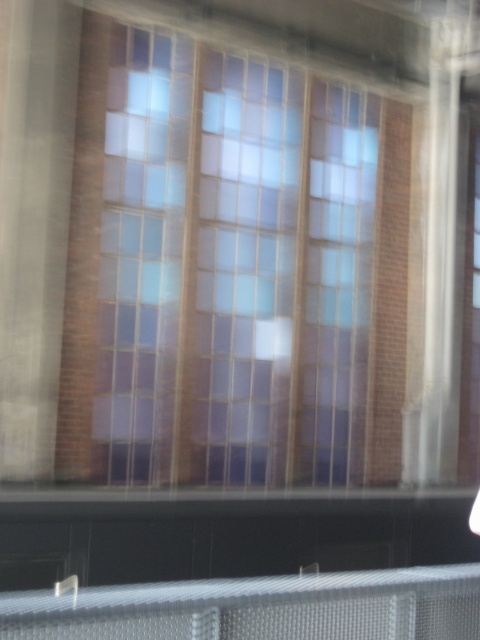
Question: Which point is farther to the camera?

Choices:
 (A) (424, 580)
 (B) (304, 362)

Answer: (B)

Question: Can you confirm if blue glass window at center is positioned to the left of metallic mesh fence at lower center?

Choices:
 (A) no
 (B) yes

Answer: (B)

Question: Can you confirm if blue glass window at center is positioned to the left of metallic mesh fence at lower center?

Choices:
 (A) no
 (B) yes

Answer: (B)

Question: Does blue glass window at center have a larger size compared to metallic mesh fence at lower center?

Choices:
 (A) no
 (B) yes

Answer: (B)